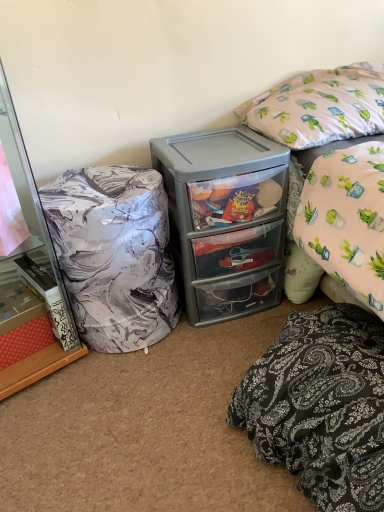
The image size is (384, 512). What are the coordinates of `vacant space in front of gray plastic storage at center` in the screenshot? It's located at (203, 360).